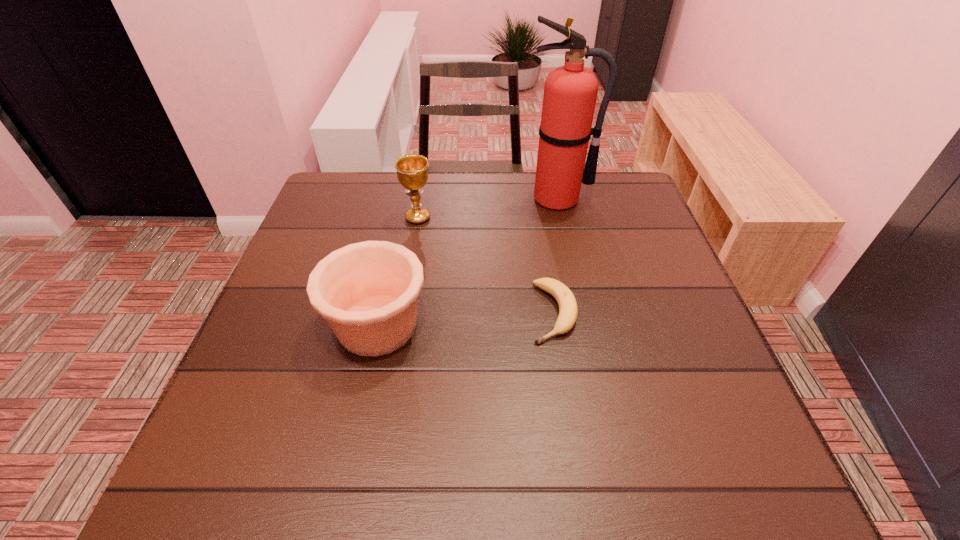
Image resolution: width=960 pixels, height=540 pixels. In order to click on fire extinguisher in this screenshot , I will do (570, 91).

Locate an element on the screen. The height and width of the screenshot is (540, 960). the second tallest object is located at coordinates (412, 170).

The height and width of the screenshot is (540, 960). Identify the location of the third tallest object. (368, 292).

Where is `the shortest object`? the shortest object is located at coordinates (568, 311).

Find the location of a particular element. free space located 0.210m at the nozzle of the tallest object is located at coordinates (572, 265).

The image size is (960, 540). What are the coordinates of `vacant space located 0.350m on the right of the chalice` in the screenshot? It's located at pyautogui.click(x=565, y=218).

Find the location of a particular element. This screenshot has width=960, height=540. vacant area situated on the right of the pottery is located at coordinates (585, 325).

Locate an element on the screen. free spot located 0.120m at the stem of the banana is located at coordinates (567, 400).

Image resolution: width=960 pixels, height=540 pixels. What are the coordinates of `fire extinguisher that is at the far edge` in the screenshot? It's located at (570, 91).

The image size is (960, 540). I want to click on chalice located at the far edge, so click(412, 170).